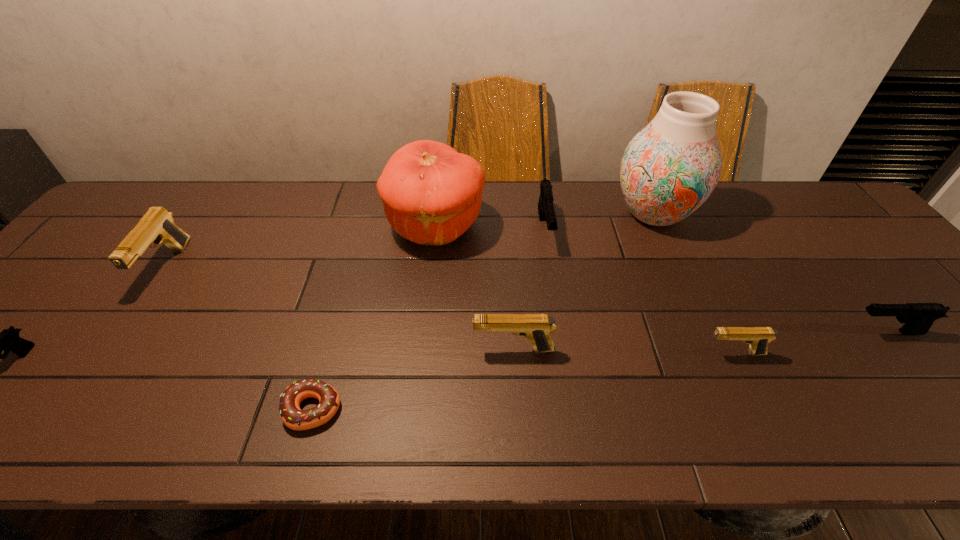
You are a GUI agent. You are given a task and a screenshot of the screen. Output one action in this format:
    pyautogui.click(x=<x>, y=<y>)
    Task: Click on the free space located 0.330m at the barrel of the second smallest tan pistol
    This screenshot has width=960, height=540.
    Given the screenshot: What is the action you would take?
    pyautogui.click(x=325, y=349)

This screenshot has width=960, height=540. I want to click on blank area located 0.240m on the front-facing side of the rightmost black pistol, so click(x=744, y=332).

At what (x,y) coordinates should I click in order to perform the action: click on vacant region located on the front-facing side of the rightmost black pistol. Please return your answer as a coordinate pair (x, y). This screenshot has width=960, height=540. Looking at the image, I should click on (709, 332).

Where is `free space located on the front-facing side of the rightmost black pistol`? The width and height of the screenshot is (960, 540). free space located on the front-facing side of the rightmost black pistol is located at coordinates [x=756, y=332].

Where is `free region located 0.180m at the barrel of the rightmost tan pistol`? free region located 0.180m at the barrel of the rightmost tan pistol is located at coordinates (622, 353).

I want to click on vacant area located 0.240m at the barrel of the rightmost tan pistol, so click(x=595, y=353).

The height and width of the screenshot is (540, 960). What are the coordinates of `vacant region located 0.260m at the barrel of the rightmost tan pistol` in the screenshot? It's located at 587,353.

Locate an element on the screen. The height and width of the screenshot is (540, 960). free space located 0.340m on the left of the doughnut is located at coordinates (115, 409).

This screenshot has height=540, width=960. I want to click on vase that is at the far edge, so click(x=668, y=170).

You are a GUI agent. You are given a task and a screenshot of the screen. Output one action in this format:
    pyautogui.click(x=<x>, y=<y>)
    Task: Click on the pumpkin that is at the far edge
    The height and width of the screenshot is (540, 960).
    Given the screenshot: What is the action you would take?
    pyautogui.click(x=431, y=194)